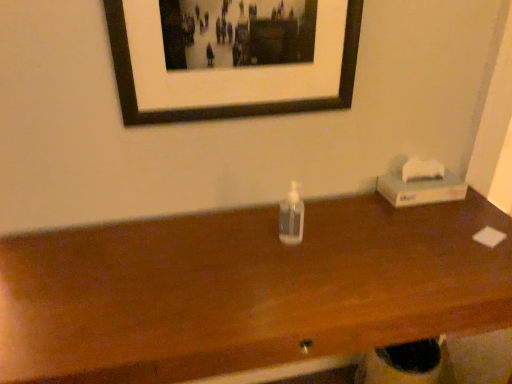
Question: Considering the positions of transparent plastic bottle at center and transparent plastic bottle at center in the image, is transparent plastic bottle at center bigger or smaller than transparent plastic bottle at center?

Choices:
 (A) big
 (B) small

Answer: (A)

Question: Is transparent plastic bottle at center taller or shorter than transparent plastic bottle at center?

Choices:
 (A) short
 (B) tall

Answer: (B)

Question: Which is nearer to the transparent plastic bottle at center?

Choices:
 (A) black matte picture frame at upper center
 (B) white cardboard tissue box at right
 (C) transparent plastic bottle at center

Answer: (C)

Question: Which is farther from the white cardboard tissue box at right?

Choices:
 (A) black matte picture frame at upper center
 (B) transparent plastic bottle at center
 (C) transparent plastic bottle at center

Answer: (A)